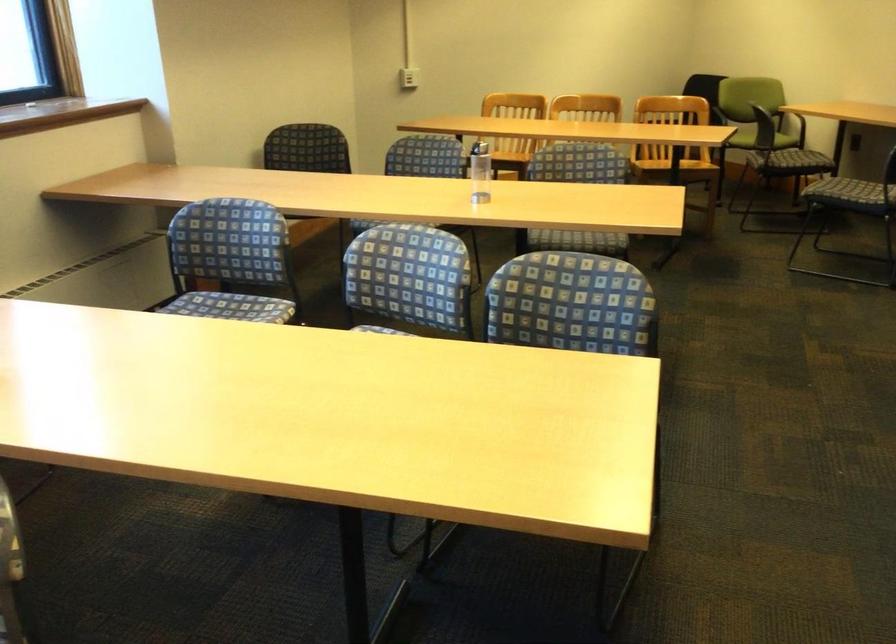
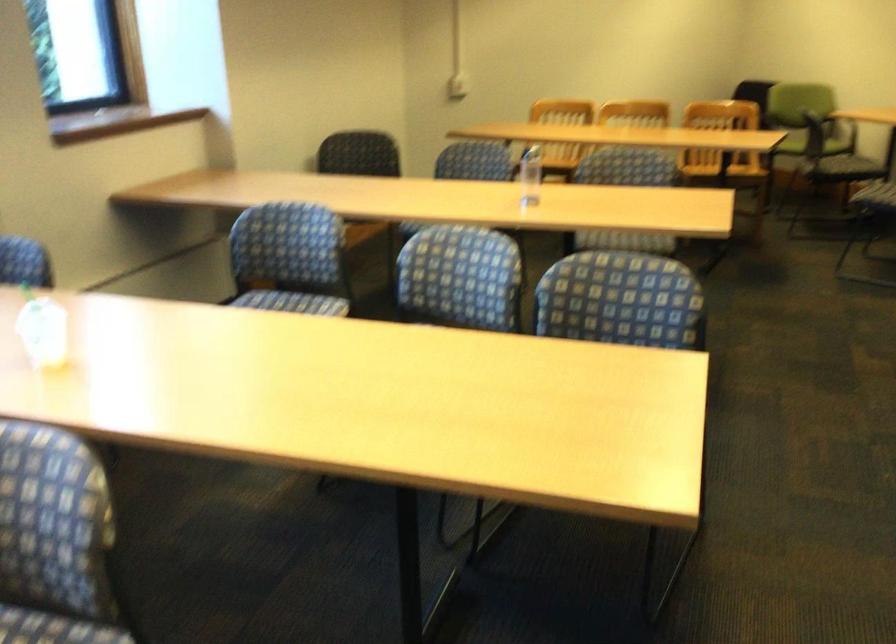
Locate, in the second image, the point that corresponds to [736,97] in the first image.

(786, 100)